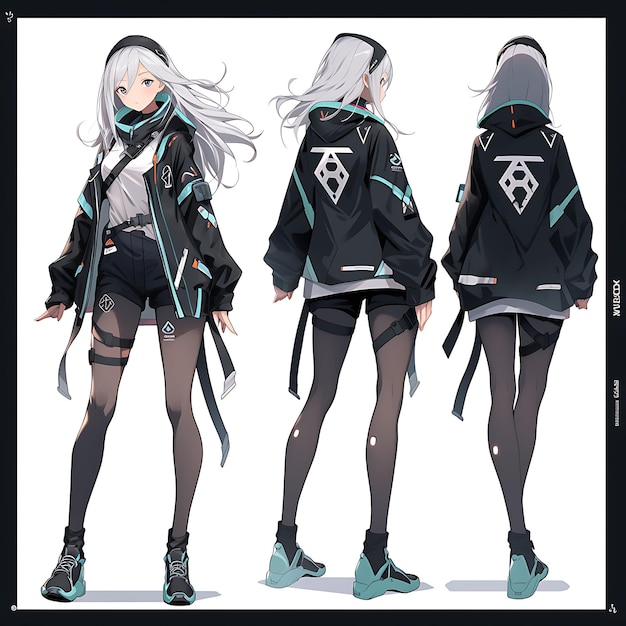
You are a GUI agent. You are given a task and a screenshot of the screen. Output one action in this format:
    pyautogui.click(x=<x>, y=<y>)
    Task: Click on the hood
    
    Given the screenshot: What is the action you would take?
    point(521,114), point(340,121)